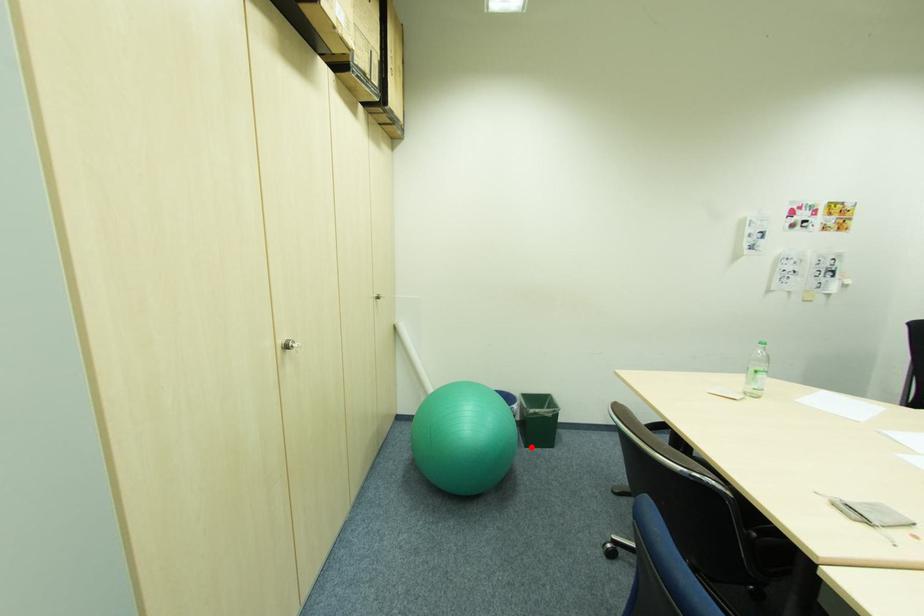
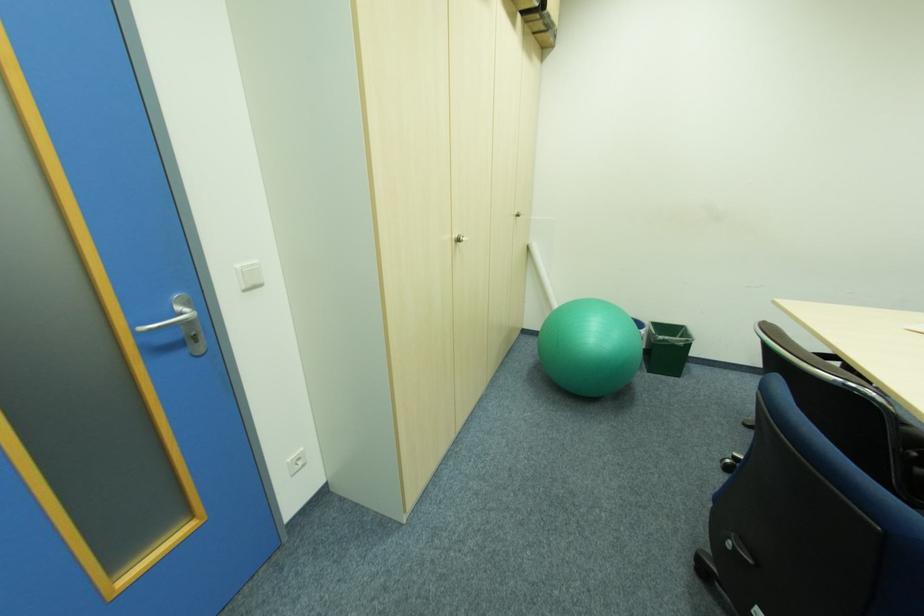
Find the pixel in the second image that matches the highlighted location in the first image.

(653, 371)